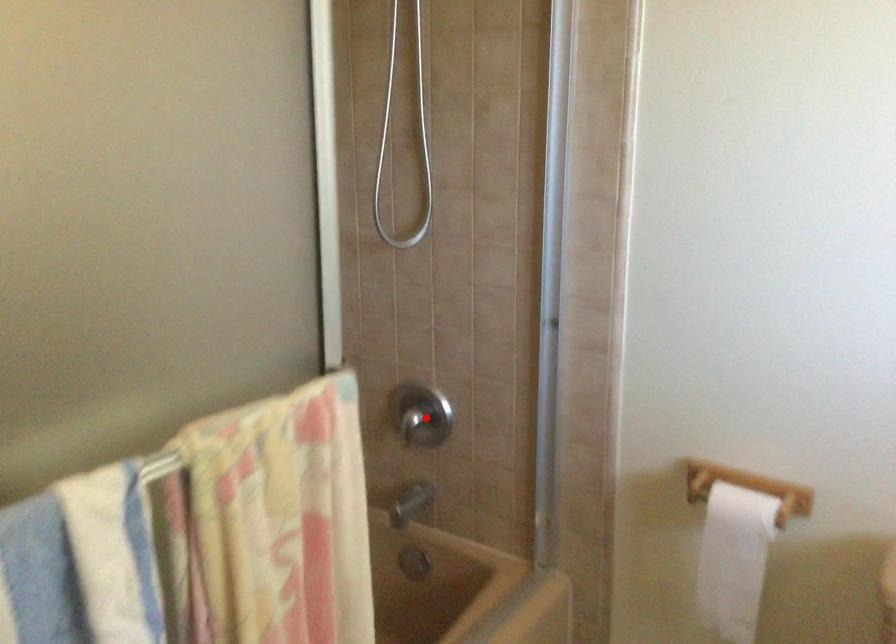
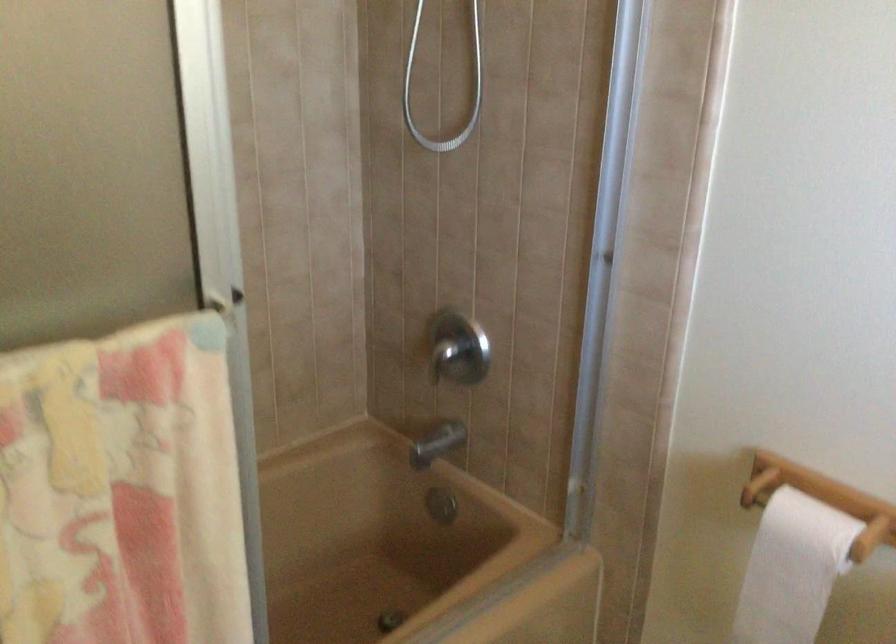
Question: I am providing you with two images of the same scene from different viewpoints. A red point is marked on the first image. Is the red point's position out of view in image 2?

Choices:
 (A) Yes
 (B) No

Answer: (B)